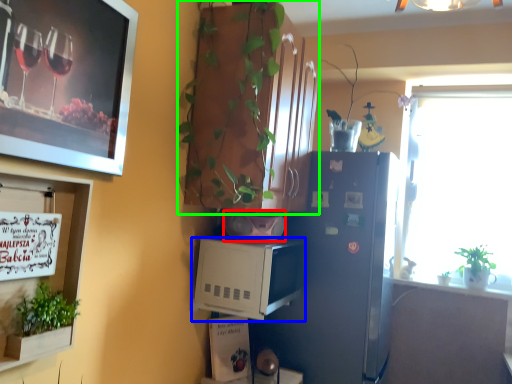
Question: Which object is positioned farthest from appliance (highlighted by a red box)? Select from appliance (highlighted by a blue box) and cabinetry (highlighted by a green box).

Choices:
 (A) appliance
 (B) cabinetry

Answer: (B)